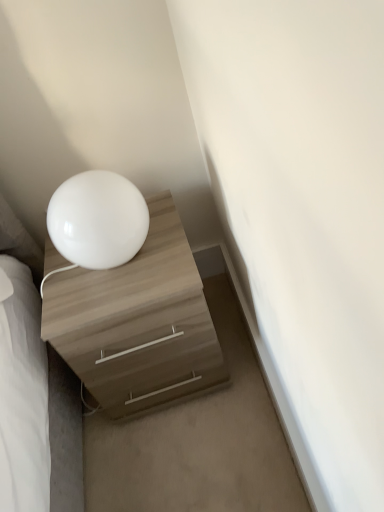
Question: From the image's perspective, is matte wood chest of drawers at lower left located above or below white glossy table lamp at upper left?

Choices:
 (A) above
 (B) below

Answer: (B)

Question: In the image, is matte wood chest of drawers at lower left on the left side or the right side of white glossy table lamp at upper left?

Choices:
 (A) left
 (B) right

Answer: (B)

Question: In terms of size, does matte wood chest of drawers at lower left appear bigger or smaller than white glossy table lamp at upper left?

Choices:
 (A) big
 (B) small

Answer: (A)

Question: Considering their positions, is white glossy table lamp at upper left located in front of or behind matte wood chest of drawers at lower left?

Choices:
 (A) behind
 (B) front

Answer: (B)

Question: From a real-world perspective, is white glossy table lamp at upper left physically located above or below matte wood chest of drawers at lower left?

Choices:
 (A) above
 (B) below

Answer: (A)

Question: Is point (117, 258) closer or farther from the camera than point (183, 388)?

Choices:
 (A) closer
 (B) farther

Answer: (A)

Question: In terms of height, does white glossy table lamp at upper left look taller or shorter compared to matte wood chest of drawers at lower left?

Choices:
 (A) tall
 (B) short

Answer: (B)